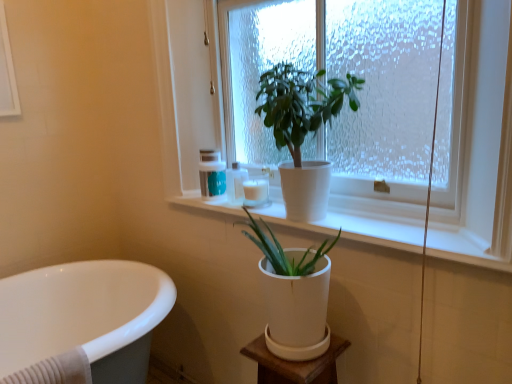
Question: Could you tell me if white matte pot at center, the first houseplant when ordered from bottom to top, is turned towards matte white container at upper center, which is counted as the third toiletry, starting from the right?

Choices:
 (A) no
 (B) yes

Answer: (A)

Question: Is white matte pot at center, the first houseplant when ordered from bottom to top, outside matte white container at upper center, which is counted as the third toiletry, starting from the right?

Choices:
 (A) yes
 (B) no

Answer: (A)

Question: From the image's perspective, is white matte pot at center, the second houseplant from the top, over matte white container at upper center, which is counted as the third toiletry, starting from the right?

Choices:
 (A) yes
 (B) no

Answer: (B)

Question: Considering the relative sizes of white matte pot at center, the second houseplant from the top, and matte white container at upper center, which is the 1th toiletry in left-to-right order, in the image provided, is white matte pot at center, the second houseplant from the top, smaller than matte white container at upper center, which is the 1th toiletry in left-to-right order,?

Choices:
 (A) no
 (B) yes

Answer: (A)

Question: Considering the relative sizes of white matte pot at center, the first houseplant when ordered from bottom to top, and matte white container at upper center, which is counted as the third toiletry, starting from the right, in the image provided, is white matte pot at center, the first houseplant when ordered from bottom to top, wider than matte white container at upper center, which is counted as the third toiletry, starting from the right,?

Choices:
 (A) no
 (B) yes

Answer: (B)

Question: Are white matte pot at center, the second houseplant from the top, and matte white container at upper center, which is counted as the third toiletry, starting from the right, located far from each other?

Choices:
 (A) yes
 (B) no

Answer: (B)

Question: From a real-world perspective, does matte white container at upper center, which is counted as the third toiletry, starting from the right, sit lower than matte white bottle at upper center, placed as the 2th toiletry when sorted from left to right?

Choices:
 (A) no
 (B) yes

Answer: (A)

Question: Considering the relative sizes of matte white container at upper center, which is counted as the third toiletry, starting from the right, and matte white bottle at upper center, placed as the 2th toiletry when sorted from left to right, in the image provided, is matte white container at upper center, which is counted as the third toiletry, starting from the right, shorter than matte white bottle at upper center, placed as the 2th toiletry when sorted from left to right,?

Choices:
 (A) no
 (B) yes

Answer: (A)

Question: From a real-world perspective, is matte white container at upper center, which is counted as the third toiletry, starting from the right, physically above matte white bottle at upper center, placed as the 2th toiletry when sorted from left to right?

Choices:
 (A) no
 (B) yes

Answer: (B)

Question: From the image's perspective, is matte white container at upper center, which is the 1th toiletry in left-to-right order, beneath matte white bottle at upper center, the 2th toiletry positioned from the right?

Choices:
 (A) no
 (B) yes

Answer: (A)

Question: Would you say matte white container at upper center, which is the 1th toiletry in left-to-right order, contains matte white bottle at upper center, the 2th toiletry positioned from the right?

Choices:
 (A) yes
 (B) no

Answer: (B)

Question: Can you confirm if matte white container at upper center, which is the 1th toiletry in left-to-right order, is taller than matte white bottle at upper center, placed as the 2th toiletry when sorted from left to right?

Choices:
 (A) yes
 (B) no

Answer: (A)

Question: Can you confirm if white glossy bathtub at lower left is smaller than green matte plant at upper center, acting as the 1th houseplant starting from the top?

Choices:
 (A) yes
 (B) no

Answer: (B)